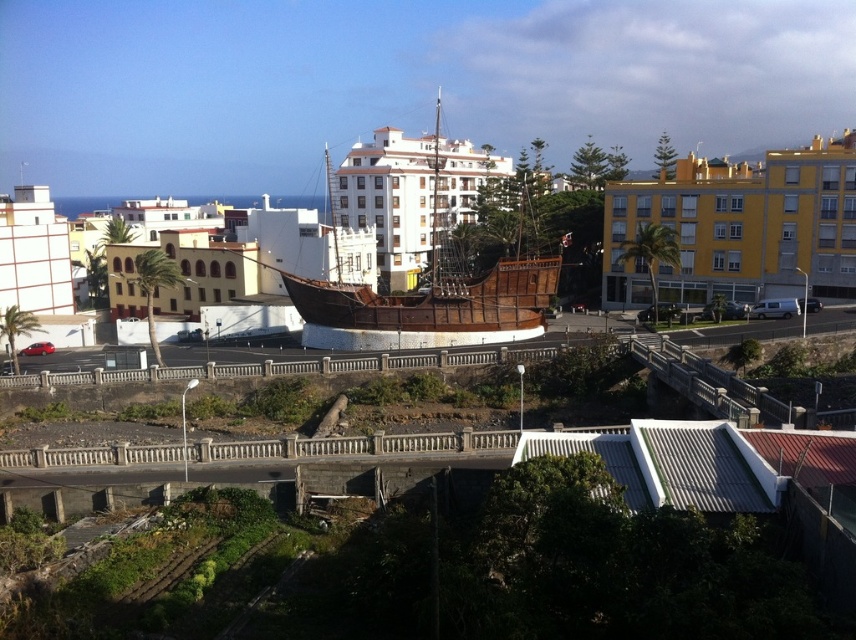
From the picture: You are a tourist standing in the coastal town and want to take a photo of both the yellow matte building at center and the white textured building at left. Based on their positions, which building should you stand closer to in order to capture both in a single frame?

The yellow matte building at center is positioned on the right side of white textured building at left. To capture both in a single frame, you should stand closer to the white textured building at left so that the yellow matte building at center remains on the right side within the camera view.

Based on the photo, you are an architect visiting the coastal town and see the yellow matte building at center and the wooden pirate ship at center. Which structure has a greater height?

The wooden pirate ship at center is taller than the yellow matte building at center, so the wooden pirate ship at center has a greater height.

You are a city planner reviewing the coastal area layout. You need to allocate space for a new public garden. Given the presence of the white matte building at center and the white textured building at left, which building would require less area to be cleared around it for the garden?

The white textured building at left is smaller in size than the white matte building at center, so less area would need to be cleared around it for the garden.